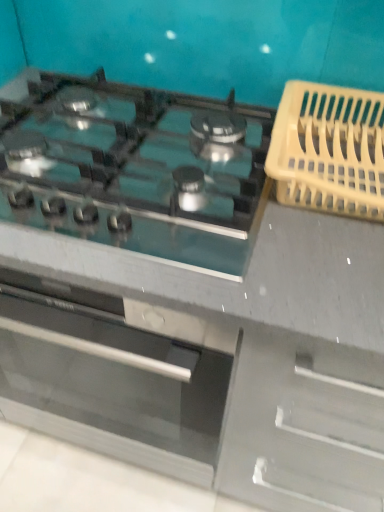
Question: Could you tell me if satin silver gas stove at center is facing yellow plastic basket at right?

Choices:
 (A) no
 (B) yes

Answer: (A)

Question: Could yellow plastic basket at right be considered to be inside satin silver gas stove at center?

Choices:
 (A) yes
 (B) no

Answer: (B)

Question: Does satin silver gas stove at center come in front of yellow plastic basket at right?

Choices:
 (A) yes
 (B) no

Answer: (A)

Question: Does satin silver gas stove at center have a smaller size compared to yellow plastic basket at right?

Choices:
 (A) yes
 (B) no

Answer: (B)

Question: Is satin silver gas stove at center outside yellow plastic basket at right?

Choices:
 (A) no
 (B) yes

Answer: (B)

Question: From a real-world perspective, is satin silver gas stove at center positioned over yellow plastic basket at right based on gravity?

Choices:
 (A) yes
 (B) no

Answer: (B)

Question: Does yellow plastic basket at right have a larger size compared to satin silver gas stove at center?

Choices:
 (A) no
 (B) yes

Answer: (A)

Question: Would you say satin silver gas stove at center is part of yellow plastic basket at right's contents?

Choices:
 (A) yes
 (B) no

Answer: (B)

Question: Considering the relative sizes of yellow plastic basket at right and satin silver gas stove at center in the image provided, is yellow plastic basket at right smaller than satin silver gas stove at center?

Choices:
 (A) no
 (B) yes

Answer: (B)

Question: Is yellow plastic basket at right directly adjacent to satin silver gas stove at center?

Choices:
 (A) yes
 (B) no

Answer: (B)

Question: From a real-world perspective, is yellow plastic basket at right positioned under satin silver gas stove at center based on gravity?

Choices:
 (A) no
 (B) yes

Answer: (A)

Question: Is yellow plastic basket at right turned away from satin silver gas stove at center?

Choices:
 (A) yes
 (B) no

Answer: (B)

Question: In terms of height, does satin silver gas stove at center look taller or shorter compared to yellow plastic basket at right?

Choices:
 (A) short
 (B) tall

Answer: (A)